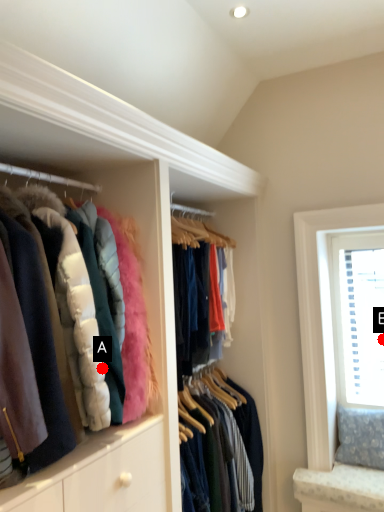
Question: Two points are circled on the image, labeled by A and B beside each circle. Which point is closer to the camera?

Choices:
 (A) A is closer
 (B) B is closer

Answer: (A)